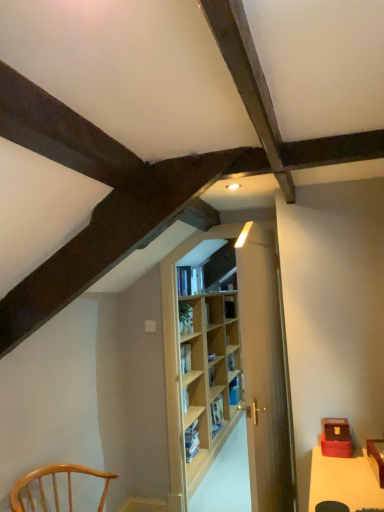
Question: From a real-world perspective, is wooden door at center physically located above or below light brown wooden chair at lower left?

Choices:
 (A) below
 (B) above

Answer: (B)

Question: Considering the positions of wooden door at center and light brown wooden chair at lower left in the image, is wooden door at center bigger or smaller than light brown wooden chair at lower left?

Choices:
 (A) big
 (B) small

Answer: (A)

Question: Estimate the real-world distances between objects in this image. Which object is closer to the blue hardcover book at center, which is the 1th book in bottom-to-top order?

Choices:
 (A) light brown wooden chair at lower left
 (B) wooden door at center
 (C) light wood shelf at center
 (D) hardcover book at center, the 1th book positioned from the front

Answer: (C)

Question: Estimate the real-world distances between objects in this image. Which object is closer to the hardcover book at center, the 1th book positioned from the front?

Choices:
 (A) wooden door at center
 (B) light brown wooden chair at lower left
 (C) light wood shelf at center
 (D) blue hardcover book at center, placed as the second book when sorted from front to back

Answer: (C)